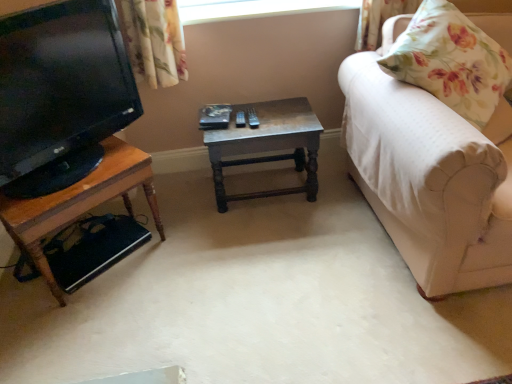
Find the location of a particular element. Image resolution: width=512 pixels, height=384 pixels. vacant space in between woodenobject at left, arranged as the second table when viewed from the right, and wooden table at center, acting as the first table starting from the right is located at coordinates (197, 225).